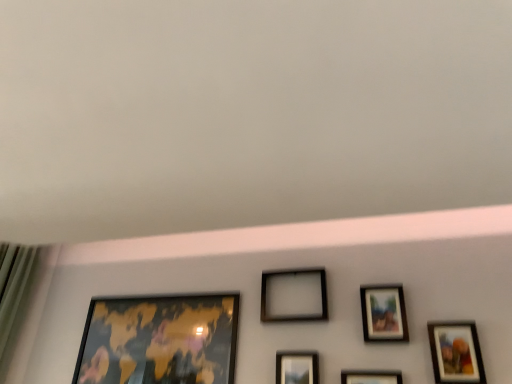
Question: Is matte black picture frame at center, which ranks as the 3th picture frame in right-to-left order, behind matte wooden picture frame at lower right, which appears as the sixth picture frame when viewed from the left?

Choices:
 (A) no
 (B) yes

Answer: (B)

Question: From the image's perspective, is matte black picture frame at center, which ranks as the 3th picture frame in right-to-left order, beneath matte wooden picture frame at lower right, which appears as the sixth picture frame when viewed from the left?

Choices:
 (A) yes
 (B) no

Answer: (A)

Question: Is matte black picture frame at center, the fourth picture frame viewed from the left, at the left side of matte wooden picture frame at lower right, positioned as the 1th picture frame in right-to-left order?

Choices:
 (A) no
 (B) yes

Answer: (B)

Question: Could you tell me if matte black picture frame at center, which ranks as the 3th picture frame in right-to-left order, is turned towards matte wooden picture frame at lower right, which appears as the sixth picture frame when viewed from the left?

Choices:
 (A) yes
 (B) no

Answer: (B)

Question: Is matte black picture frame at center, which ranks as the 3th picture frame in right-to-left order, taller than matte wooden picture frame at lower right, positioned as the 1th picture frame in right-to-left order?

Choices:
 (A) no
 (B) yes

Answer: (A)

Question: Is point (458, 360) closer or farther from the camera than point (170, 362)?

Choices:
 (A) closer
 (B) farther

Answer: (A)

Question: Visually, is matte wooden picture frame at lower right, which appears as the sixth picture frame when viewed from the left, positioned to the left or to the right of gold metallic map at lower left, which is the first picture frame in left-to-right order?

Choices:
 (A) right
 (B) left

Answer: (A)

Question: Is matte wooden picture frame at lower right, which appears as the sixth picture frame when viewed from the left, in front of or behind gold metallic map at lower left, which is the first picture frame in left-to-right order, in the image?

Choices:
 (A) behind
 (B) front

Answer: (B)

Question: From the image's perspective, is matte wooden picture frame at lower right, which appears as the sixth picture frame when viewed from the left, located above or below gold metallic map at lower left, the 6th picture frame viewed from the right?

Choices:
 (A) below
 (B) above

Answer: (B)

Question: Considering the positions of point (266, 301) and point (166, 314), is point (266, 301) closer or farther from the camera than point (166, 314)?

Choices:
 (A) farther
 (B) closer

Answer: (B)

Question: Relative to gold metallic map at lower left, which is the first picture frame in left-to-right order, is black matte picture frame at center, which ranks as the 3th picture frame in left-to-right order, in front or behind?

Choices:
 (A) behind
 (B) front

Answer: (A)

Question: In the image, is black matte picture frame at center, acting as the fourth picture frame starting from the right, on the left side or the right side of gold metallic map at lower left, which is the first picture frame in left-to-right order?

Choices:
 (A) right
 (B) left

Answer: (A)

Question: Looking at their shapes, would you say black matte picture frame at center, which ranks as the 3th picture frame in left-to-right order, is wider or thinner than gold metallic map at lower left, the 6th picture frame viewed from the right?

Choices:
 (A) thin
 (B) wide

Answer: (B)

Question: Is matte black picture frame at center, the fourth picture frame viewed from the left, in front of or behind black matte picture frame at center, which ranks as the 3th picture frame in left-to-right order, in the image?

Choices:
 (A) behind
 (B) front

Answer: (B)

Question: Is point (366, 372) positioned closer to the camera than point (269, 291)?

Choices:
 (A) closer
 (B) farther

Answer: (A)